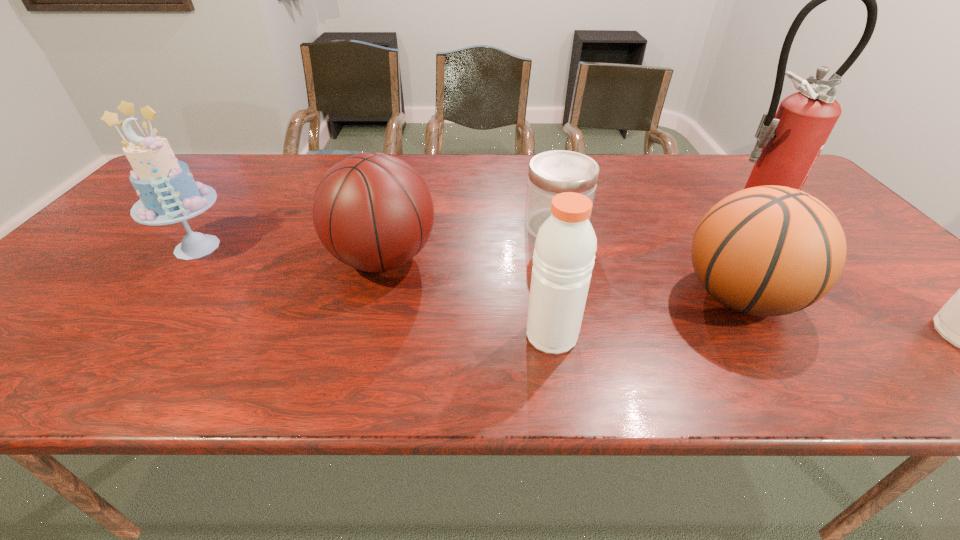
This screenshot has width=960, height=540. In order to click on the third tallest object in this screenshot , I will do `click(565, 246)`.

Find the location of a particular element. Image resolution: width=960 pixels, height=540 pixels. fire extinguisher is located at coordinates (789, 142).

The height and width of the screenshot is (540, 960). Find the location of `the fifth object from right to left`. the fifth object from right to left is located at coordinates (372, 211).

This screenshot has height=540, width=960. What are the coordinates of `jar` in the screenshot? It's located at (550, 173).

Where is `the leftmost object`? The width and height of the screenshot is (960, 540). the leftmost object is located at coordinates (168, 194).

Identify the location of the right basketball. (770, 250).

At what (x,y) coordinates should I click in order to perform the action: click on vacant area situated on the right of the shaker. Please return your answer as a coordinate pair (x, y). The height and width of the screenshot is (540, 960). Looking at the image, I should click on (602, 335).

Identify the location of vacant region located 0.180m at the nozzle of the fire extinguisher. (798, 265).

Where is `vacant area situated on the right of the fifth object from right to left`? This screenshot has height=540, width=960. vacant area situated on the right of the fifth object from right to left is located at coordinates (503, 259).

Identify the location of vacant space positioned 0.180m on the right of the jar. The width and height of the screenshot is (960, 540). (655, 227).